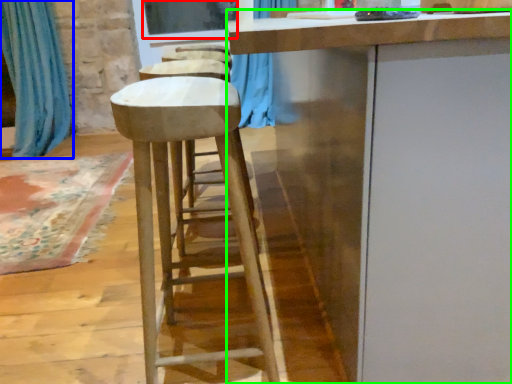
Question: Which is nearer to the window screen (highlighted by a red box)? curtain (highlighted by a blue box) or cabinetry (highlighted by a green box).

Choices:
 (A) curtain
 (B) cabinetry

Answer: (A)